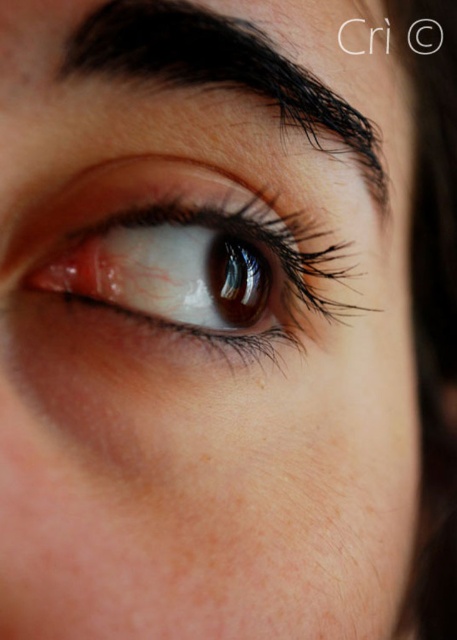
Question: Which of the following is the closest to the observer?

Choices:
 (A) coord(75,179)
 (B) coord(116,42)

Answer: (B)

Question: Which of the following is the closest to the observer?

Choices:
 (A) pos(264,61)
 (B) pos(190,273)

Answer: (A)

Question: Among these objects, which one is farthest from the camera?

Choices:
 (A) brown glossy eye at center
 (B) brown hair at upper center

Answer: (A)

Question: Can you confirm if brown glossy eye at center is thinner than brown hair at upper center?

Choices:
 (A) yes
 (B) no

Answer: (B)

Question: Considering the relative positions of brown glossy eye at center and brown hair at upper center in the image provided, where is brown glossy eye at center located with respect to brown hair at upper center?

Choices:
 (A) left
 (B) right

Answer: (A)

Question: Where is brown glossy eye at center located in relation to brown hair at upper center in the image?

Choices:
 (A) right
 (B) left

Answer: (B)